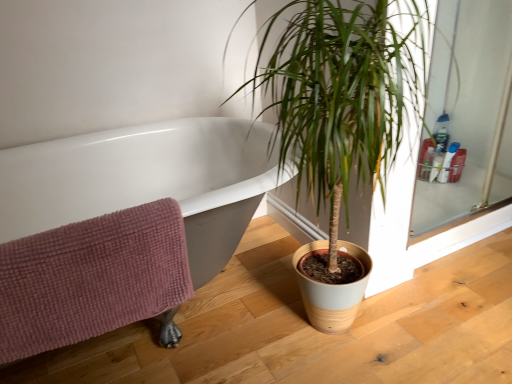
This screenshot has width=512, height=384. I want to click on vacant space in front of translucent plastic bottle at upper right, which ranks as the 3th toiletry in left-to-right order, so click(x=459, y=193).